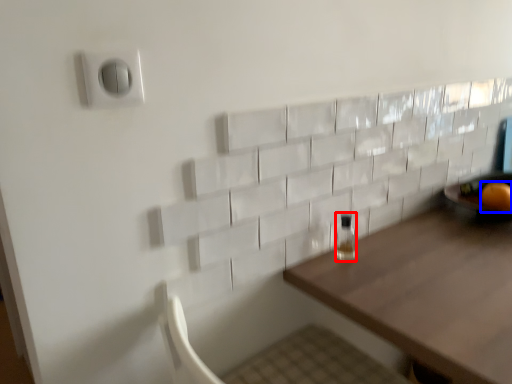
Question: Which of the following is the farthest to the observer, bottle (highlighted by a red box) or orange (highlighted by a blue box)?

Choices:
 (A) bottle
 (B) orange

Answer: (B)